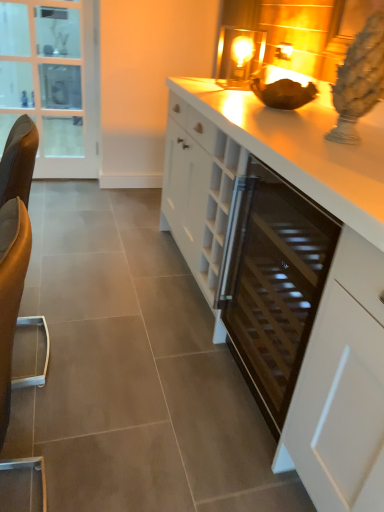
What is the approximate height of brown leather swivel chair at left?

It is 93.92 centimeters.

What are the coordinates of `brown leather swivel chair at left` in the screenshot? It's located at [13, 245].

Locate an element on the screen. black glass wine cooler at center is located at coordinates (272, 283).

The image size is (384, 512). Find the location of `white glossy countertop at center`. white glossy countertop at center is located at coordinates (304, 149).

You are a GUI agent. You are given a task and a screenshot of the screen. Output one action in this format:
    pyautogui.click(x=<x>, y=<y>)
    Task: Click on the clear glass door at left
    The height and width of the screenshot is (512, 384).
    Given the screenshot: What is the action you would take?
    [53, 82]

Between brown leather swivel chair at left and white glossy countertop at center, which one appears on the right side from the viewer's perspective?

Positioned to the right is white glossy countertop at center.

Which is in front, brown leather swivel chair at left or white glossy countertop at center?

brown leather swivel chair at left is in front.

From a real-world perspective, which object rests below the other?

brown leather swivel chair at left.

Consider the image. How different are the orientations of brown leather swivel chair at left and white glossy countertop at center in degrees?

They differ by 0.851 degrees in their facing directions.

From the image's perspective, is black glass wine cooler at center under clear glass door at left?

Yes.

Is black glass wine cooler at center turned away from clear glass door at left?

No, black glass wine cooler at center is not facing the opposite direction of clear glass door at left.

How distant is black glass wine cooler at center from clear glass door at left?

black glass wine cooler at center and clear glass door at left are 7.27 feet apart from each other.

Is there a large distance between black glass wine cooler at center and clear glass door at left?

That's right, there is a large distance between black glass wine cooler at center and clear glass door at left.

Identify the location of swivel chair lying below the white glossy countertop at center (from the image's perspective). (13, 245).

Does white glossy countertop at center contain brown leather swivel chair at left?

No, brown leather swivel chair at left is not inside white glossy countertop at center.

Is white glossy countertop at center closer to camera compared to brown leather swivel chair at left?

No, white glossy countertop at center is further to the viewer.

Is brown leather swivel chair at left not inside white matte cabinet at center?

brown leather swivel chair at left lies outside white matte cabinet at center's area.

Which object is positioned more to the left, brown leather swivel chair at left or white matte cabinet at center?

brown leather swivel chair at left is more to the left.

From the image's perspective, is brown leather swivel chair at left positioned above or below white matte cabinet at center?

brown leather swivel chair at left is above white matte cabinet at center.

Is brown leather swivel chair at left facing away from white matte cabinet at center?

No, brown leather swivel chair at left is not facing away from white matte cabinet at center.

In the scene shown: Could you tell me if black glass wine cooler at center is turned towards brown leather swivel chair at left?

Yes, black glass wine cooler at center is oriented towards brown leather swivel chair at left.

Can you tell me how much black glass wine cooler at center and brown leather swivel chair at left differ in facing direction?

There is a 0.679-degree angle between the facing directions of black glass wine cooler at center and brown leather swivel chair at left.

In the image, is black glass wine cooler at center on the left side or the right side of brown leather swivel chair at left?

From the image, it's evident that black glass wine cooler at center is to the right of brown leather swivel chair at left.

The height and width of the screenshot is (512, 384). I want to click on appliance that appears on the right of brown leather swivel chair at left, so click(x=272, y=283).

Is white glossy countertop at center to the left or to the right of white matte cabinet at center in the image?

white glossy countertop at center is positioned on white matte cabinet at center's left side.

Which of these two, white glossy countertop at center or white matte cabinet at center, stands shorter?

white matte cabinet at center is shorter.

Looking at this image, would you say white glossy countertop at center is a long distance from white matte cabinet at center?

No, there isn't a large distance between white glossy countertop at center and white matte cabinet at center.

Is white glossy countertop at center located outside white matte cabinet at center?

Yes, white glossy countertop at center is not within white matte cabinet at center.

From a real-world perspective, is black glass wine cooler at center physically above white glossy countertop at center?

No, from a real-world perspective, black glass wine cooler at center is not on top of white glossy countertop at center.

Could you tell me if black glass wine cooler at center is facing white glossy countertop at center?

No, black glass wine cooler at center does not turn towards white glossy countertop at center.

How different are the orientations of black glass wine cooler at center and white glossy countertop at center in degrees?

The angle between the facing direction of black glass wine cooler at center and the facing direction of white glossy countertop at center is 0.173 degrees.

Is black glass wine cooler at center beside white glossy countertop at center?

No.

Where is `countertop located above the brown leather swivel chair at left (from the image's perspective)`? countertop located above the brown leather swivel chair at left (from the image's perspective) is located at coordinates (304, 149).

The width and height of the screenshot is (384, 512). I want to click on appliance in front of the clear glass door at left, so click(x=272, y=283).

Looking at the image, which one is located closer to brown leather swivel chair at left, black glass wine cooler at center or clear glass door at left?

black glass wine cooler at center is closer to brown leather swivel chair at left.

Which object lies nearer to the anchor point brown leather swivel chair at left, white glossy countertop at center or clear glass door at left?

white glossy countertop at center is positioned closer to the anchor brown leather swivel chair at left.

Estimate the real-world distances between objects in this image. Which object is closer to brown leather swivel chair at left, white matte cabinet at center or clear glass door at left?

The object closer to brown leather swivel chair at left is white matte cabinet at center.

Estimate the real-world distances between objects in this image. Which object is further from clear glass door at left, white glossy countertop at center or brown leather swivel chair at left?

Based on the image, brown leather swivel chair at left appears to be further to clear glass door at left.

Which object lies nearer to the anchor point brown leather swivel chair at left, white matte cabinet at center or black glass wine cooler at center?

The object closer to brown leather swivel chair at left is white matte cabinet at center.

Estimate the real-world distances between objects in this image. Which object is further from white matte cabinet at center, white glossy countertop at center or clear glass door at left?

clear glass door at left lies further to white matte cabinet at center than the other object.

When comparing their distances from white matte cabinet at center, does clear glass door at left or black glass wine cooler at center seem further?

clear glass door at left.

Looking at the image, which one is located further to white glossy countertop at center, brown leather swivel chair at left or clear glass door at left?

Among the two, clear glass door at left is located further to white glossy countertop at center.

At what (x,y) coordinates should I click in order to perform the action: click on countertop between brown leather swivel chair at left and black glass wine cooler at center in the horizontal direction. Please return your answer as a coordinate pair (x, y). Looking at the image, I should click on click(304, 149).

At what (x,y) coordinates should I click in order to perform the action: click on countertop positioned between brown leather swivel chair at left and clear glass door at left from near to far. Please return your answer as a coordinate pair (x, y). Image resolution: width=384 pixels, height=512 pixels. Looking at the image, I should click on (304, 149).

The image size is (384, 512). Find the location of `countertop between black glass wine cooler at center and clear glass door at left from front to back`. countertop between black glass wine cooler at center and clear glass door at left from front to back is located at coordinates (304, 149).

At what (x,y) coordinates should I click in order to perform the action: click on swivel chair located between black glass wine cooler at center and clear glass door at left in the depth direction. Please return your answer as a coordinate pair (x, y). The width and height of the screenshot is (384, 512). Looking at the image, I should click on (x=13, y=245).